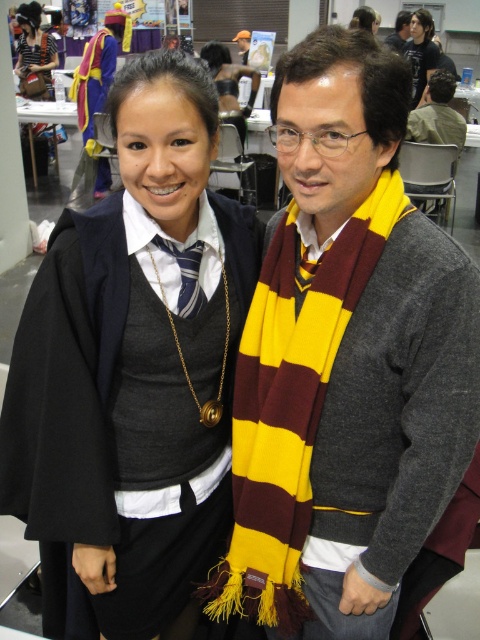
In the scene shown: Between matte black cape at center and yellow and maroon striped scarf at center, which one has less height?

With less height is yellow and maroon striped scarf at center.

Is point (22, 326) positioned before point (243, 33)?

That is True.

This screenshot has width=480, height=640. I want to click on matte black cape at center, so click(134, 362).

Is maroon and yellow striped scarf at right taller than matte black hair at upper center?

No.

Does point (396, 195) come farther from viewer compared to point (420, 26)?

No.

Describe the element at coordinates (289, 406) in the screenshot. I see `maroon and yellow striped scarf at right` at that location.

The height and width of the screenshot is (640, 480). What are the coordinates of `maroon and yellow striped scarf at right` in the screenshot? It's located at (289, 406).

Can you confirm if brown leather jacket at upper right is taller than matte black hair at upper center?

Incorrect, brown leather jacket at upper right's height is not larger of matte black hair at upper center's.

Is point (435, 116) positioned in front of point (412, 80)?

No, it is behind (412, 80).

Where is `brown leather jacket at upper right`? brown leather jacket at upper right is located at coordinates (436, 115).